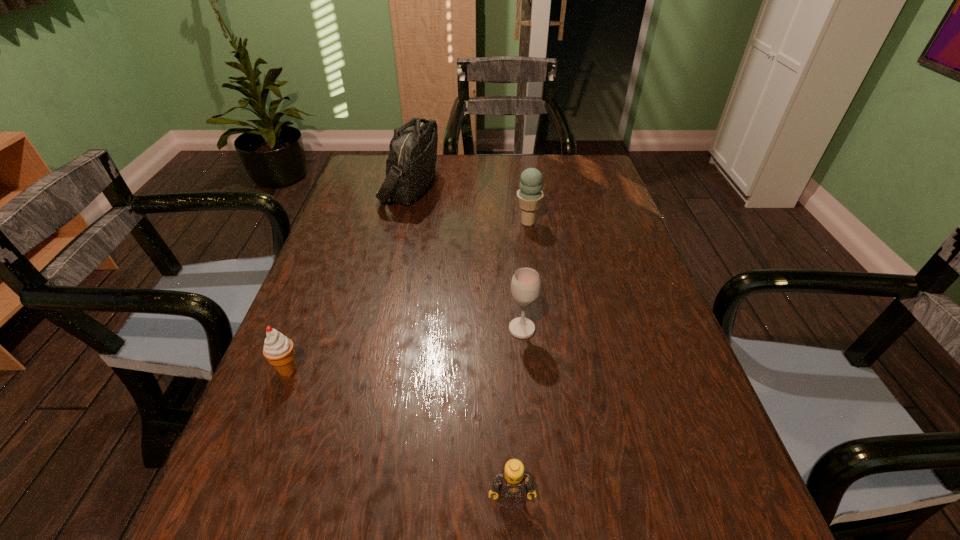
Find the location of `unoccupied position between the farthest object and the third farthest object`. unoccupied position between the farthest object and the third farthest object is located at coordinates (467, 257).

In order to click on free area in between the nearer icecream and the third farthest object in this screenshot , I will do `click(405, 349)`.

This screenshot has height=540, width=960. What are the coordinates of `free area in between the shoulder bag and the taller icecream` in the screenshot? It's located at (469, 204).

In order to click on unoccupied position between the Lego and the nearer icecream in this screenshot , I will do `click(399, 435)`.

Identify the location of free space between the wineglass and the nearer icecream. pyautogui.click(x=405, y=349).

Image resolution: width=960 pixels, height=540 pixels. Identify the location of free area in between the wineglass and the nearer icecream. (405, 349).

Where is `blank region between the second object from left to right and the Lego`? blank region between the second object from left to right and the Lego is located at coordinates (461, 343).

At what (x,y) coordinates should I click in order to perform the action: click on object that stands as the third closest to the third farthest object. Please return your answer as a coordinate pair (x, y). Looking at the image, I should click on (278, 349).

Where is `the second closest object to the third farthest object`? The width and height of the screenshot is (960, 540). the second closest object to the third farthest object is located at coordinates (530, 194).

Find the location of `blank area in the image that satisfies the following two spatial constraints: 1. at the front padded panel of the wineglass; 2. on the left side of the shoulder bag`. blank area in the image that satisfies the following two spatial constraints: 1. at the front padded panel of the wineglass; 2. on the left side of the shoulder bag is located at coordinates pos(378,329).